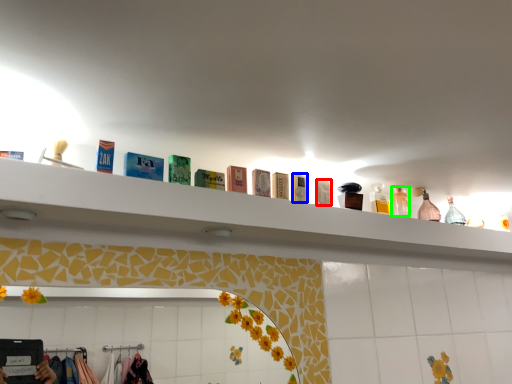
Question: Which object is the farthest from toiletry (highlighted by a red box)? Choose among these: toiletry (highlighted by a blue box) or toiletry (highlighted by a green box).

Choices:
 (A) toiletry
 (B) toiletry

Answer: (B)